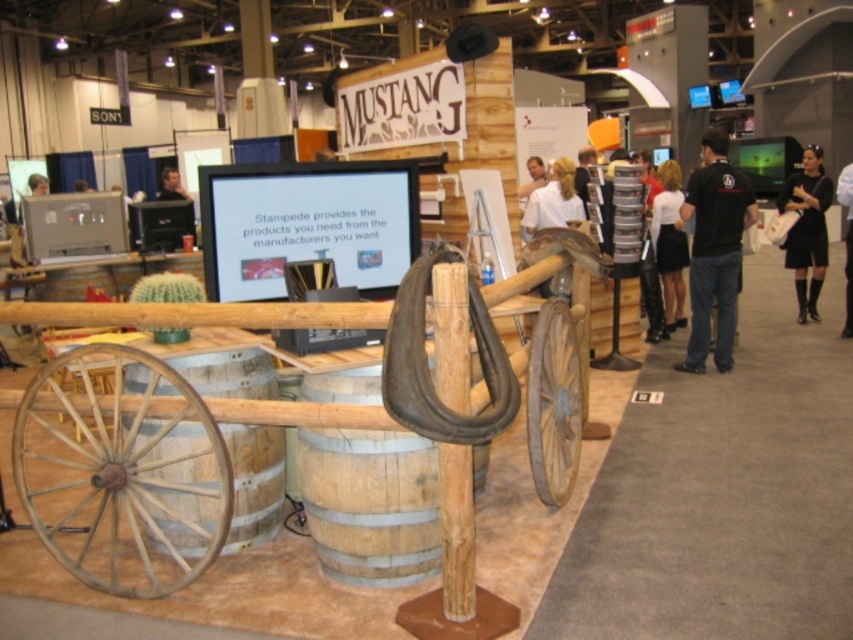
Question: Where is wooden barrel at center located in relation to black cotton shirt at right in the image?

Choices:
 (A) above
 (B) below

Answer: (B)

Question: Which object is closer to the camera taking this photo?

Choices:
 (A) wooden wagon wheel at lower left
 (B) brown wooden barrel at lower left
 (C) smooth skin face at upper left

Answer: (A)

Question: Which of the following is the farthest from the observer?

Choices:
 (A) (805, 177)
 (B) (849, 189)
 (C) (543, 168)

Answer: (C)

Question: Can you confirm if wooden barrel at center is smaller than smooth wooden barrel at center?

Choices:
 (A) no
 (B) yes

Answer: (A)

Question: Is brown wooden barrel at lower left further to the viewer compared to smooth skin face at upper left?

Choices:
 (A) no
 (B) yes

Answer: (A)

Question: Which object is farther from the camera taking this photo?

Choices:
 (A) black dress at right
 (B) rustic wood wheel at lower right
 (C) wooden barrel at center

Answer: (A)